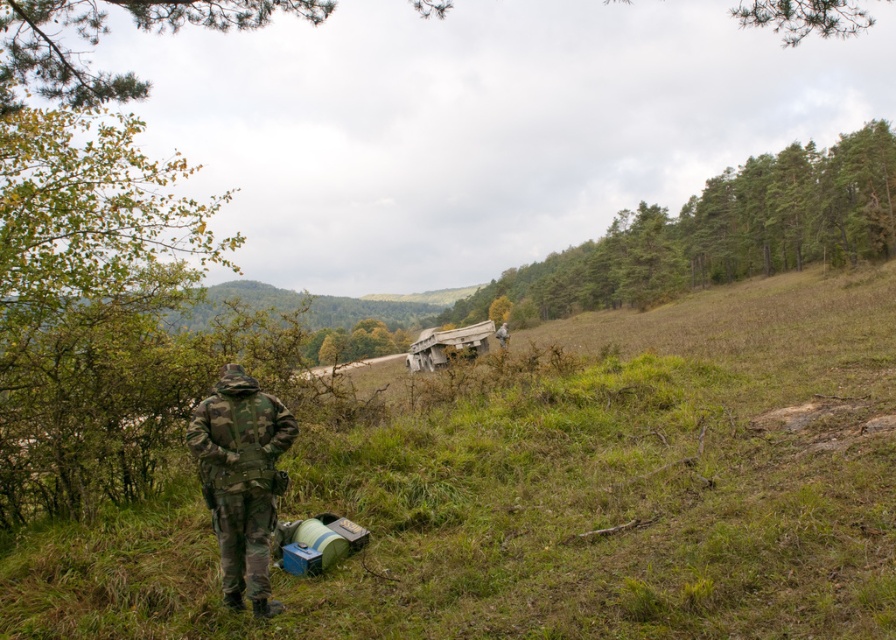
You are a drone operator trying to capture a clear aerial view of the green grassy at center and camouflage fabric soldier at center. Based on their positions, which object would appear lower in the image?

The green grassy at center appears lower in the image because it is positioned below the camouflage fabric soldier at center.